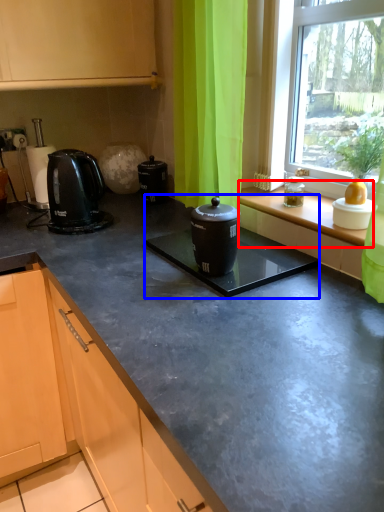
Question: Among these objects, which one is farthest to the camera, window sill (highlighted by a red box) or sink (highlighted by a blue box)?

Choices:
 (A) window sill
 (B) sink

Answer: (A)